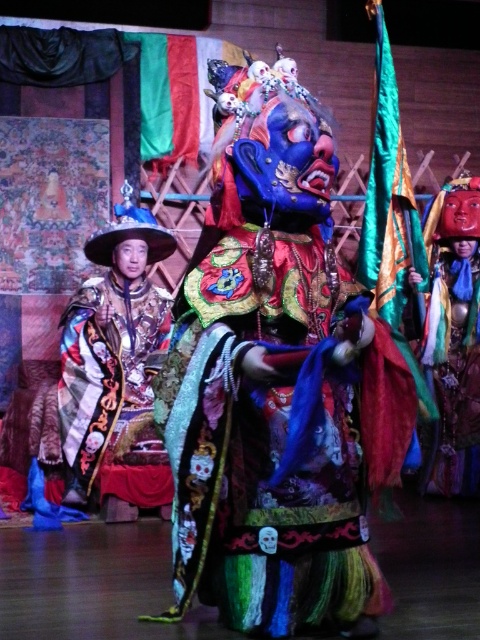
Can you confirm if velvet brocade robe at center is positioned below velvet-like multicolored robe at center?

Yes, velvet brocade robe at center is below velvet-like multicolored robe at center.

Does velvet brocade robe at center lie behind velvet-like multicolored robe at center?

Yes, velvet brocade robe at center is behind velvet-like multicolored robe at center.

Identify the location of velvet brocade robe at center. (109, 378).

The image size is (480, 640). Find the location of `velvet brocade robe at center`. velvet brocade robe at center is located at coordinates (109, 378).

Who is positioned more to the left, velvet-like blue mask at center or velvet brocade robe at center?

velvet brocade robe at center is more to the left.

Which is above, velvet-like blue mask at center or velvet brocade robe at center?

velvet-like blue mask at center

Does point (268, 307) come closer to viewer compared to point (132, 355)?

Yes, it is.

Find the location of a particular element. The height and width of the screenshot is (640, 480). velvet-like blue mask at center is located at coordinates (277, 387).

Identify the location of velvet-like blue mask at center. This screenshot has width=480, height=640. (277, 387).

Can you confirm if velvet-like blue mask at center is positioned above velvet-like multicolored robe at center?

Yes.

This screenshot has height=640, width=480. I want to click on velvet-like blue mask at center, so click(x=277, y=387).

The width and height of the screenshot is (480, 640). I want to click on velvet-like blue mask at center, so click(x=277, y=387).